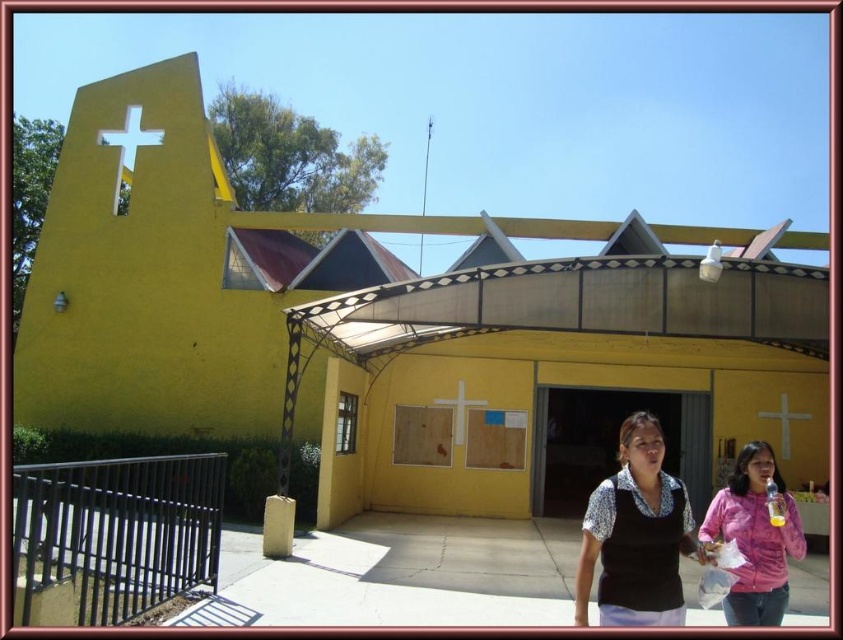
Can you confirm if matte black blouse at center is positioned to the left of white matte cross at center?

Incorrect, matte black blouse at center is not on the left side of white matte cross at center.

Is point (583, 541) behind point (459, 412)?

No, it is not.

This screenshot has height=640, width=843. Find the location of `matte black blouse at center`. matte black blouse at center is located at coordinates (636, 536).

Who is more forward, (538, 333) or (750, 508)?

Positioned in front is point (750, 508).

Is yellow matte building at center closer to the viewer compared to pink fabric shirt at lower right?

No, it is behind pink fabric shirt at lower right.

Who is more distant from viewer, (438, 310) or (785, 561)?

The point (438, 310) is more distant.

I want to click on yellow matte building at center, so click(395, 324).

Between matte black blouse at center and white matte cross at upper center, which one is positioned lower?

Positioned lower is white matte cross at upper center.

Can you confirm if matte black blouse at center is positioned above white matte cross at upper center?

Yes, matte black blouse at center is above white matte cross at upper center.

Is point (670, 492) farther from camera compared to point (784, 392)?

No, it is in front of (784, 392).

Where is `matte black blouse at center`? This screenshot has height=640, width=843. matte black blouse at center is located at coordinates (636, 536).